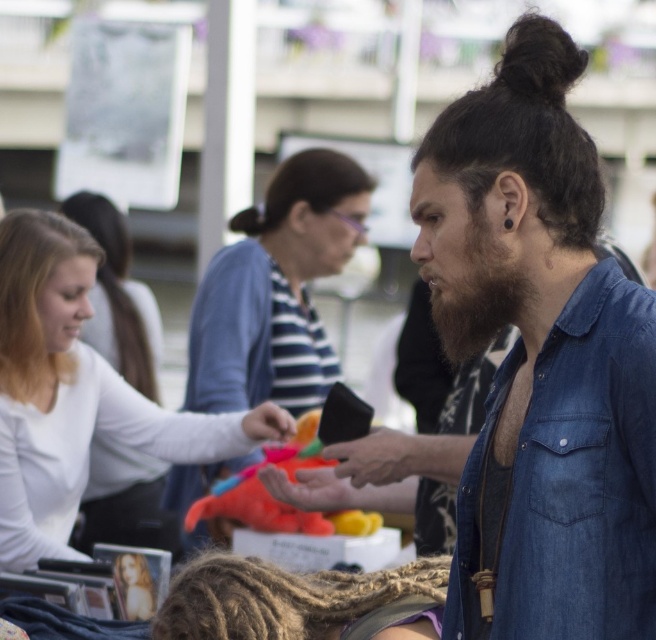
Question: Is dark brown hair at center bigger than blonde hair at upper left?

Choices:
 (A) no
 (B) yes

Answer: (A)

Question: Which object is closer to the camera taking this photo?

Choices:
 (A) plush orange toy at center
 (B) blonde hair at left

Answer: (A)

Question: Can you confirm if denim shirt at center is positioned to the right of dark brown hair at upper center?

Choices:
 (A) no
 (B) yes

Answer: (B)

Question: Which object appears farthest from the camera in this image?

Choices:
 (A) striped fabric shirt at center
 (B) dark brown hair at center

Answer: (A)

Question: Among these points, which one is nearest to the camera?

Choices:
 (A) 592,358
 (B) 123,253
 (C) 256,516
 (D) 337,164

Answer: (A)

Question: Where is dreadlocks at center located in relation to blonde hair at upper left in the image?

Choices:
 (A) right
 (B) left

Answer: (A)